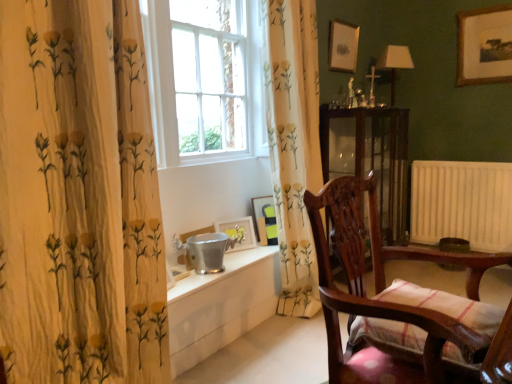
Question: Looking at their shapes, would you say white glass window at center is wider or thinner than matte white picture frame at upper center, the second picture frame in the right-to-left sequence?

Choices:
 (A) wide
 (B) thin

Answer: (A)

Question: Visually, is white glass window at center positioned to the left or to the right of matte white picture frame at upper center, the second picture frame in the right-to-left sequence?

Choices:
 (A) left
 (B) right

Answer: (A)

Question: Estimate the real-world distances between objects in this image. Which object is closer to the white painted radiator at right?

Choices:
 (A) white glossy table at lower center
 (B) wooden picture frame at lower center, which ranks as the 3th picture frame in left-to-right order
 (C) metallic silver picture frame at lower center, which appears as the first picture frame when viewed from the left
 (D) matte silver picture frame at lower center, the 2th picture frame positioned from the bottom
 (E) matte white picture frame at upper center, which ranks as the 2th picture frame in top-to-bottom order

Answer: (E)

Question: Which of these objects is positioned farthest from the matte silver picture frame at lower center, placed as the fourth picture frame when sorted from top to bottom?

Choices:
 (A) metallic silver picture frame at lower center, the 1th picture frame positioned from the bottom
 (B) transparent glass cabinet at center
 (C) white floral-patterned curtain at left, which is counted as the 1th curtain, starting from the left
 (D) floral fabric curtain at center, which appears as the second curtain when viewed from the left
 (E) wooden chair with striped cushion at right

Answer: (E)